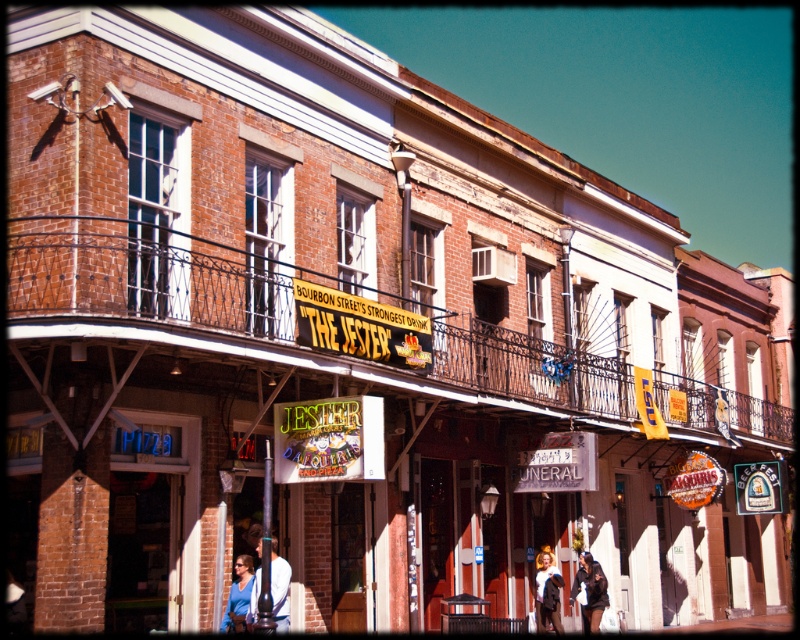
Question: Which point appears farthest from the camera in this image?

Choices:
 (A) (740, 412)
 (B) (596, 573)

Answer: (A)

Question: Based on their relative distances, which object is nearer to the brown wrought iron balcony at center?

Choices:
 (A) white cotton shirt at center
 (B) black leather jacket at lower center
 (C) blue fabric shirt at lower center

Answer: (C)

Question: In this image, where is brown wrought iron balcony at center located relative to black leather jacket at lower center?

Choices:
 (A) left
 (B) right

Answer: (B)

Question: Does black leather jacket at lower center have a greater width compared to white cotton shirt at center?

Choices:
 (A) yes
 (B) no

Answer: (A)

Question: Which point is farther to the camera?

Choices:
 (A) (244, 620)
 (B) (601, 611)
 (C) (254, 592)

Answer: (B)

Question: Can you confirm if brown wrought iron balcony at center is smaller than white cotton shirt at center?

Choices:
 (A) no
 (B) yes

Answer: (A)